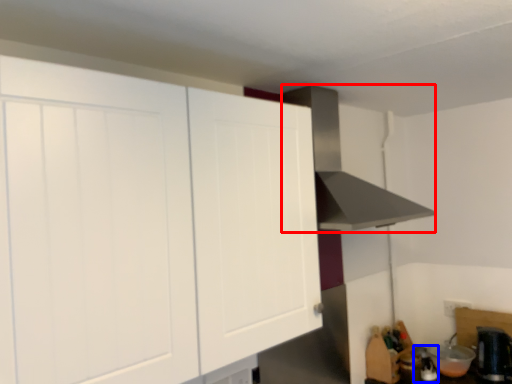
Question: Among these objects, which one is farthest to the camera, vent (highlighted by a red box) or appliance (highlighted by a blue box)?

Choices:
 (A) vent
 (B) appliance

Answer: (B)